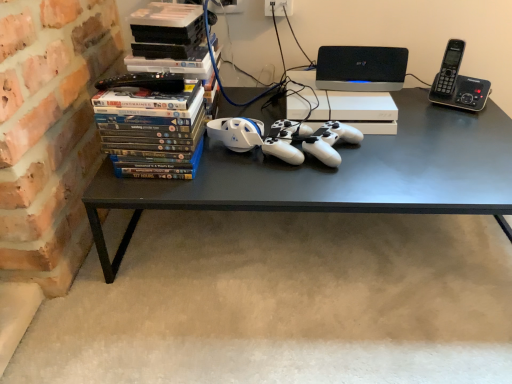
Question: Are black plastic phone at upper right and black plastic speaker at upper center making contact?

Choices:
 (A) yes
 (B) no

Answer: (B)

Question: Would you say black plastic phone at upper right is outside black plastic speaker at upper center?

Choices:
 (A) no
 (B) yes

Answer: (B)

Question: Is black plastic phone at upper right positioned in front of black plastic speaker at upper center?

Choices:
 (A) yes
 (B) no

Answer: (A)

Question: Can you confirm if black plastic phone at upper right is thinner than black plastic speaker at upper center?

Choices:
 (A) no
 (B) yes

Answer: (A)

Question: Considering the relative sizes of black plastic phone at upper right and black plastic speaker at upper center in the image provided, is black plastic phone at upper right shorter than black plastic speaker at upper center?

Choices:
 (A) yes
 (B) no

Answer: (B)

Question: Is black plastic phone at upper right further to the viewer compared to black plastic speaker at upper center?

Choices:
 (A) no
 (B) yes

Answer: (A)

Question: Is the surface of black matte desk at center in direct contact with black plastic speaker at upper center?

Choices:
 (A) yes
 (B) no

Answer: (B)

Question: From the image's perspective, is black matte desk at center over black plastic speaker at upper center?

Choices:
 (A) no
 (B) yes

Answer: (A)

Question: Is black matte desk at center positioned in front of black plastic speaker at upper center?

Choices:
 (A) yes
 (B) no

Answer: (A)

Question: From the image's perspective, is black matte desk at center located beneath black plastic speaker at upper center?

Choices:
 (A) yes
 (B) no

Answer: (A)

Question: Is black matte desk at center thinner than black plastic speaker at upper center?

Choices:
 (A) yes
 (B) no

Answer: (B)

Question: Considering the relative sizes of black matte desk at center and black plastic speaker at upper center in the image provided, is black matte desk at center shorter than black plastic speaker at upper center?

Choices:
 (A) yes
 (B) no

Answer: (B)

Question: Are black matte desk at center and matte plastic dvds at left far apart?

Choices:
 (A) no
 (B) yes

Answer: (A)